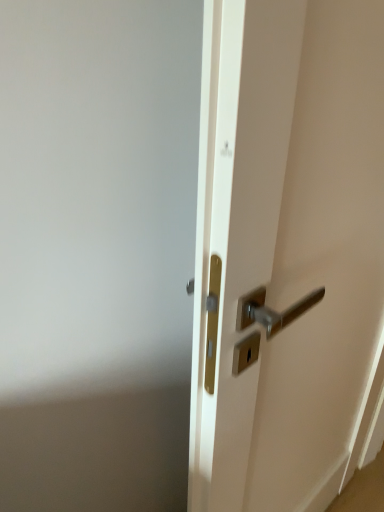
The width and height of the screenshot is (384, 512). Describe the element at coordinates (286, 249) in the screenshot. I see `matte silver handle at center` at that location.

Where is `matte silver handle at center`? matte silver handle at center is located at coordinates (286, 249).

The image size is (384, 512). In order to click on matte silver handle at center in this screenshot , I will do `click(286, 249)`.